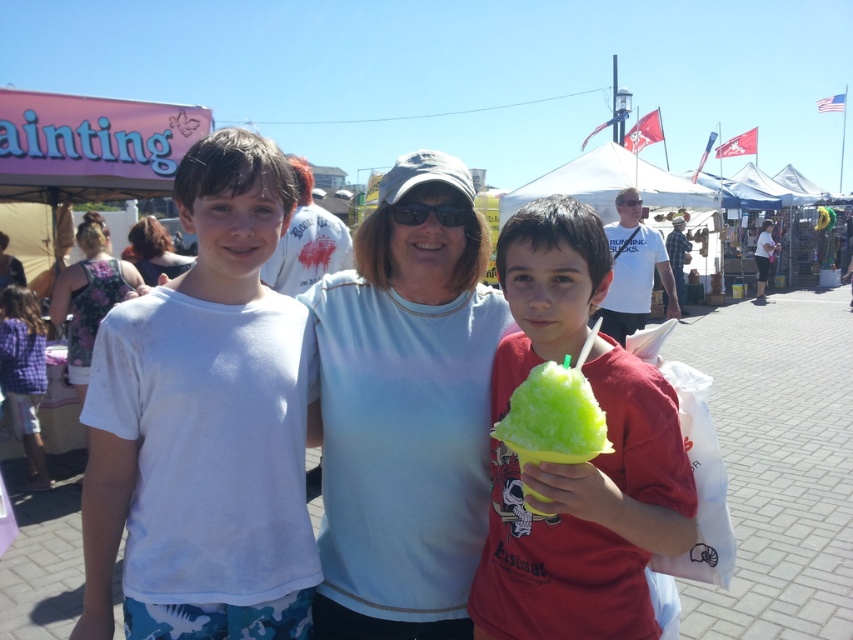
Is point (19, 294) less distant than point (165, 243)?

Yes, point (19, 294) is closer to viewer.

Does purple checkered shirt at left appear under matte brown hair at center?

Yes.

Measure the distance between point (33, 397) and camera.

Point (33, 397) is 5.20 meters from camera.

The width and height of the screenshot is (853, 640). Identify the location of purple checkered shirt at left. (22, 372).

Who is taller, light blue fabric at center or green matte ice cream cone at right?

With more height is light blue fabric at center.

Does light blue fabric at center have a lesser height compared to green matte ice cream cone at right?

Incorrect, light blue fabric at center's height does not fall short of green matte ice cream cone at right's.

Image resolution: width=853 pixels, height=640 pixels. Identify the location of light blue fabric at center. (405, 413).

Between green matte ice cream cone at right and purple checkered shirt at left, which one is positioned lower?

purple checkered shirt at left is lower down.

Where is `green matte ice cream cone at right`? green matte ice cream cone at right is located at coordinates (553, 417).